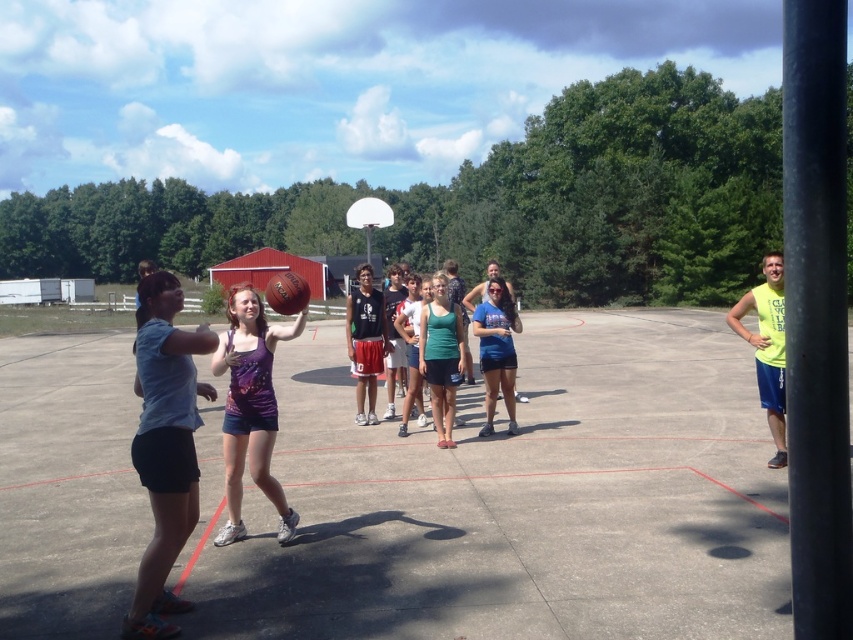
You are a photographer trying to capture a candid shot of the basketball game. You notice the matte green tank top at center and the blue denim shorts at center. Which clothing item should you focus on if you want to photograph someone standing to the left side of the other?

The matte green tank top at center is positioned on the left side of blue denim shorts at center, so focusing on the matte green tank top at center would capture someone standing to the left of the blue denim shorts at center.

You are a photographer positioned at the right side of the basketball court. You want to take a photo that includes both the light blue cotton shirt at left and the green cotton tank top at center. Which direction should you move to ensure both are in the frame?

The light blue cotton shirt at left is to the left of the green cotton tank top at center. To include both in the frame, move to the right so that both the light blue cotton shirt at left and the green cotton tank top at center are within your camera view.